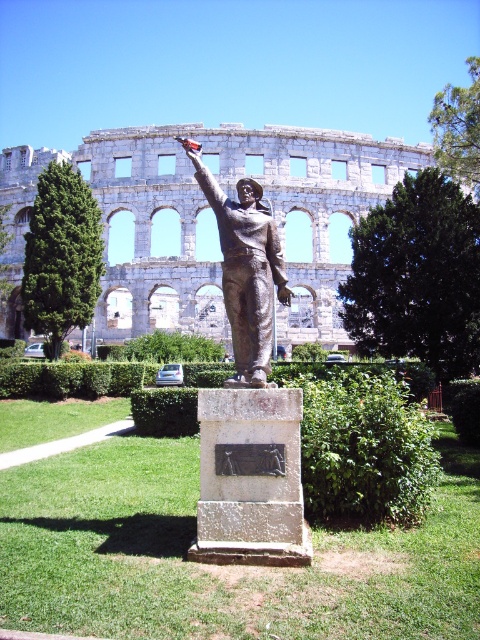
Question: Does gray stone amphitheater at upper center appear over bronze statue at center?

Choices:
 (A) no
 (B) yes

Answer: (B)

Question: Which point is farther to the camera?

Choices:
 (A) (228, 269)
 (B) (186, 336)
 (C) (67, 156)

Answer: (C)

Question: Is gray stone amphitheater at upper center to the right of bronze statue at center from the viewer's perspective?

Choices:
 (A) yes
 (B) no

Answer: (B)

Question: Considering the real-world distances, which object is closest to the green leafy hedge at center?

Choices:
 (A) gray stone amphitheater at upper center
 (B) bronze statue at center

Answer: (A)

Question: Can you confirm if gray stone amphitheater at upper center is positioned to the left of green leafy hedge at center?

Choices:
 (A) no
 (B) yes

Answer: (A)

Question: Which of the following is the closest to the observer?

Choices:
 (A) (361, 192)
 (B) (208, 360)
 (C) (229, 298)

Answer: (C)